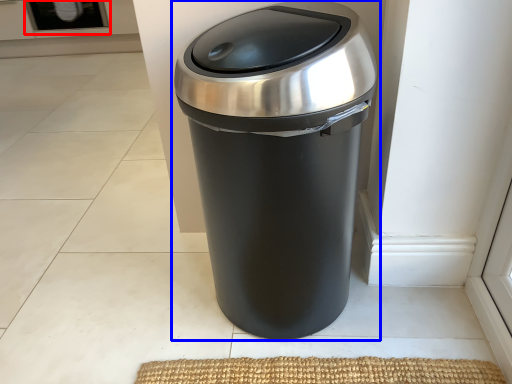
Question: Which object is further to the camera taking this photo, screen door (highlighted by a red box) or waste container (highlighted by a blue box)?

Choices:
 (A) screen door
 (B) waste container

Answer: (A)